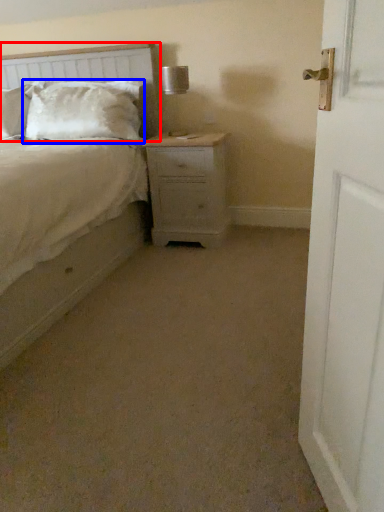
Question: Which of the following is the farthest to the observer, headboard (highlighted by a red box) or pillow (highlighted by a blue box)?

Choices:
 (A) headboard
 (B) pillow

Answer: (B)